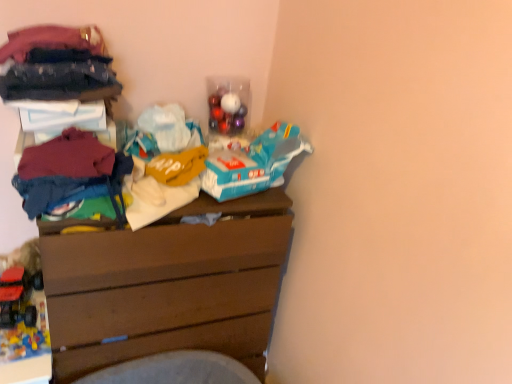
This screenshot has height=384, width=512. I want to click on free space above maroon cotton sweater at left, marked as the third clothing in a top-to-bottom arrangement (from a real-world perspective), so click(69, 163).